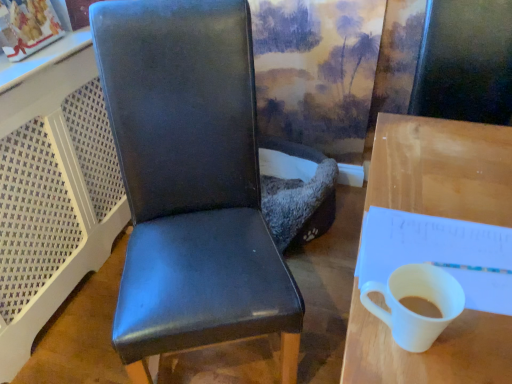
Locate an element on the screen. The width and height of the screenshot is (512, 384). free space above white paper notepad at right (from a real-world perspective) is located at coordinates (436, 234).